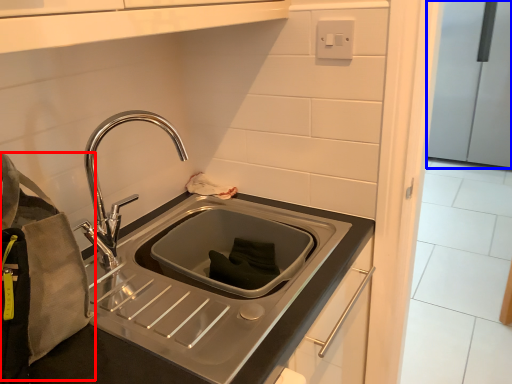
Question: Among these objects, which one is nearest to the camera, pouch (highlighted by a red box) or appliance (highlighted by a blue box)?

Choices:
 (A) pouch
 (B) appliance

Answer: (A)